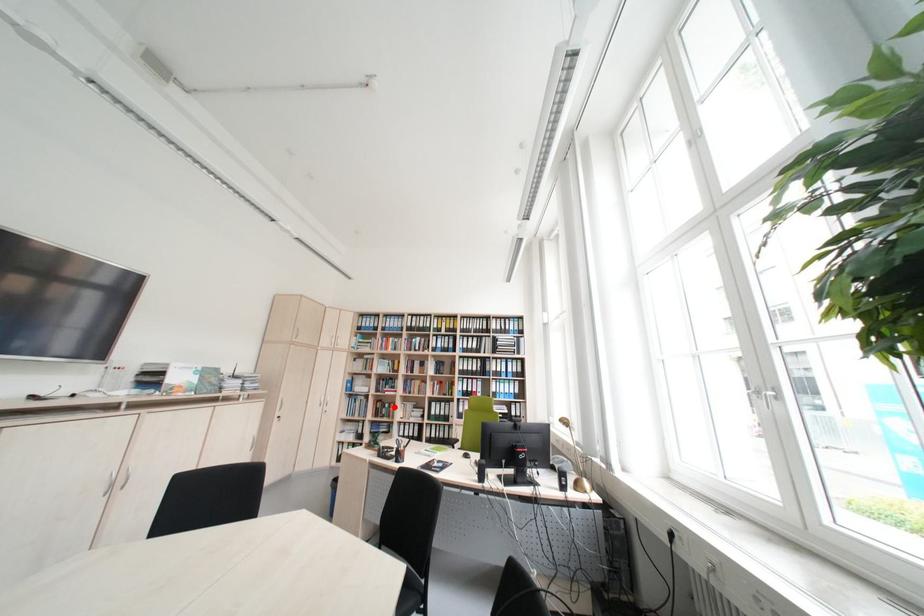
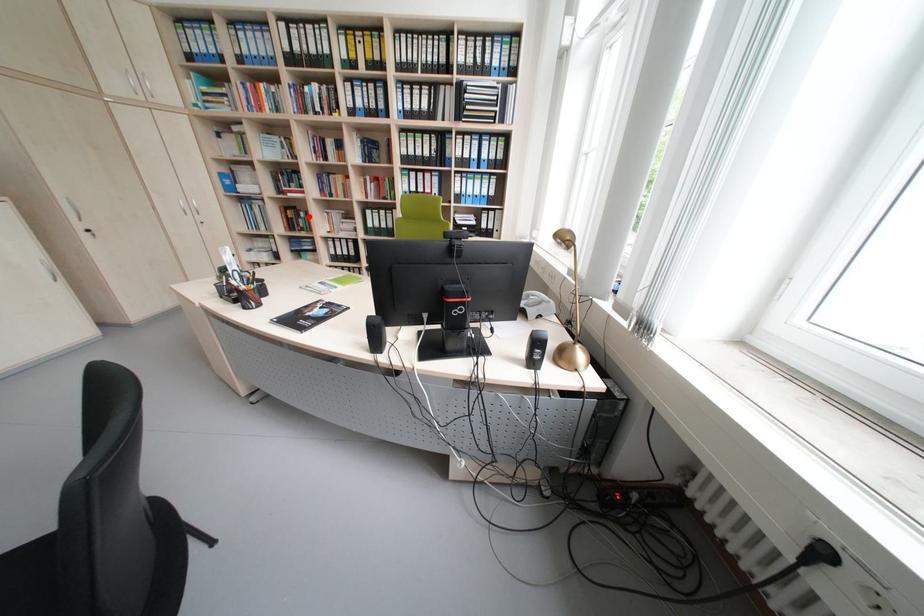
I am providing you with two images of the same scene from different viewpoints. A red point is marked on the first image and another point is marked on the second image. Is the red point in image1 aligned with the point shown in image2?

Yes